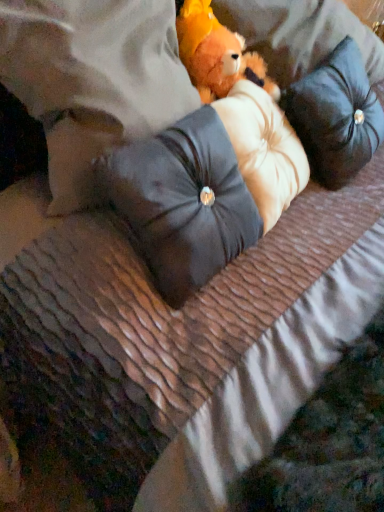
Question: Can you confirm if fluffy orange teddy bear at center is shorter than leather-like pillow at center, which is counted as the first pillow, starting from the left?

Choices:
 (A) yes
 (B) no

Answer: (A)

Question: Is fluffy orange teddy bear at center facing away from leather-like pillow at center, which is counted as the first pillow, starting from the left?

Choices:
 (A) yes
 (B) no

Answer: (B)

Question: Does fluffy orange teddy bear at center appear on the left side of leather-like pillow at center, the third pillow from the right?

Choices:
 (A) yes
 (B) no

Answer: (B)

Question: Is fluffy orange teddy bear at center not within leather-like pillow at center, which is counted as the first pillow, starting from the left?

Choices:
 (A) yes
 (B) no

Answer: (A)

Question: Does fluffy orange teddy bear at center come behind leather-like pillow at center, the third pillow from the right?

Choices:
 (A) no
 (B) yes

Answer: (B)

Question: Considering the relative sizes of fluffy orange teddy bear at center and leather-like pillow at center, the third pillow from the right, in the image provided, is fluffy orange teddy bear at center bigger than leather-like pillow at center, the third pillow from the right,?

Choices:
 (A) yes
 (B) no

Answer: (B)

Question: Is black velvet pillow at upper right, placed as the 1th pillow when sorted from right to left, positioned beyond the bounds of fluffy orange teddy bear at center?

Choices:
 (A) no
 (B) yes

Answer: (B)

Question: Is black velvet pillow at upper right, placed as the 1th pillow when sorted from right to left, further to the viewer compared to fluffy orange teddy bear at center?

Choices:
 (A) no
 (B) yes

Answer: (A)

Question: Considering the relative sizes of black velvet pillow at upper right, the 3th pillow when ordered from left to right, and fluffy orange teddy bear at center in the image provided, is black velvet pillow at upper right, the 3th pillow when ordered from left to right, smaller than fluffy orange teddy bear at center?

Choices:
 (A) yes
 (B) no

Answer: (B)

Question: Is fluffy orange teddy bear at center inside black velvet pillow at upper right, the 3th pillow when ordered from left to right?

Choices:
 (A) yes
 (B) no

Answer: (B)

Question: Considering the relative positions of black velvet pillow at upper right, placed as the 1th pillow when sorted from right to left, and fluffy orange teddy bear at center in the image provided, is black velvet pillow at upper right, placed as the 1th pillow when sorted from right to left, in front of fluffy orange teddy bear at center?

Choices:
 (A) yes
 (B) no

Answer: (A)

Question: Is black velvet pillow at upper right, the 3th pillow when ordered from left to right, facing towards fluffy orange teddy bear at center?

Choices:
 (A) yes
 (B) no

Answer: (B)

Question: Considering the relative sizes of satin black pillow at center, which ranks as the second pillow in left-to-right order, and black velvet pillow at upper right, the 3th pillow when ordered from left to right, in the image provided, is satin black pillow at center, which ranks as the second pillow in left-to-right order, thinner than black velvet pillow at upper right, the 3th pillow when ordered from left to right,?

Choices:
 (A) no
 (B) yes

Answer: (A)